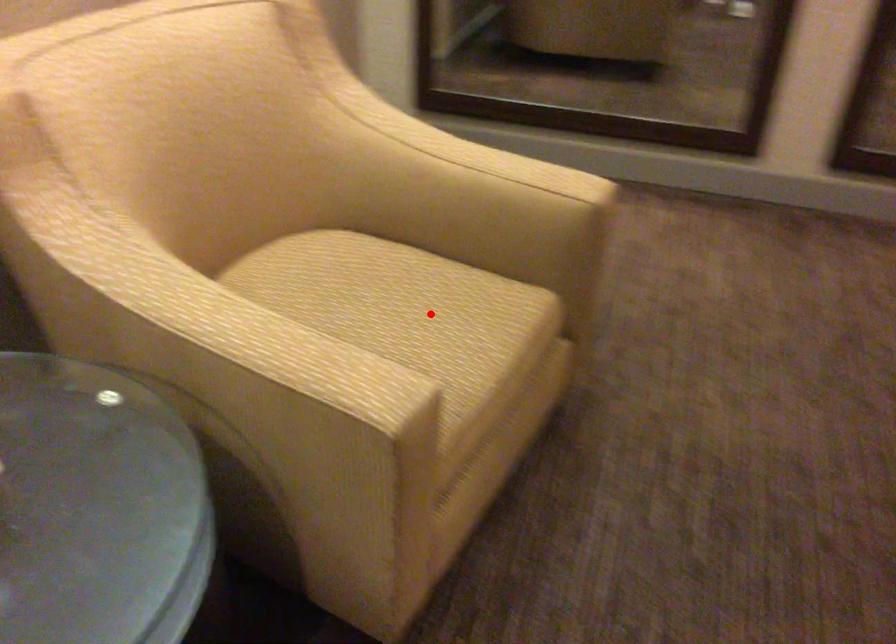
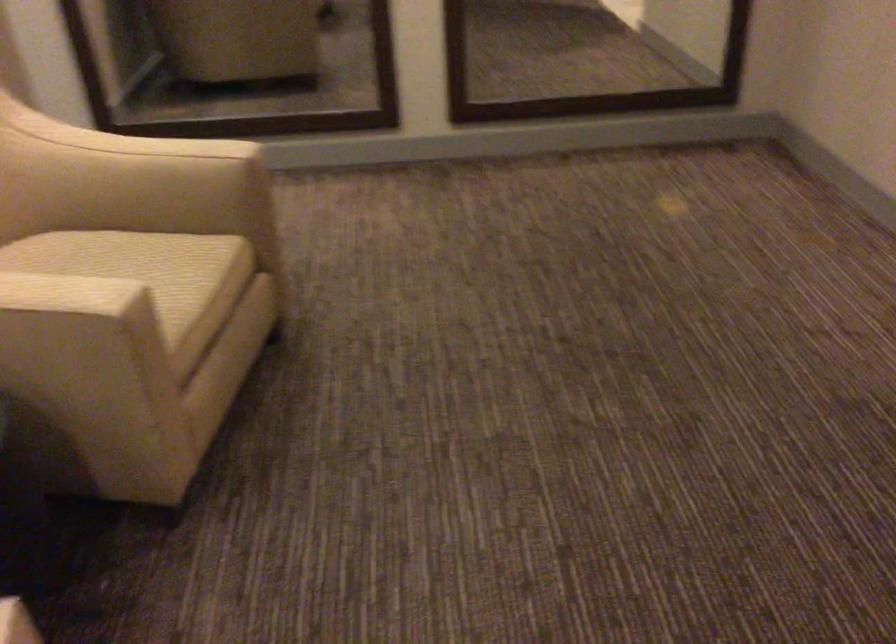
Question: I am providing you with two images of the same scene from different viewpoints. In image1, a red point is highlighted. Considering the same 3D point in image2, which of the following is correct?

Choices:
 (A) It is closer
 (B) It is farther

Answer: (B)